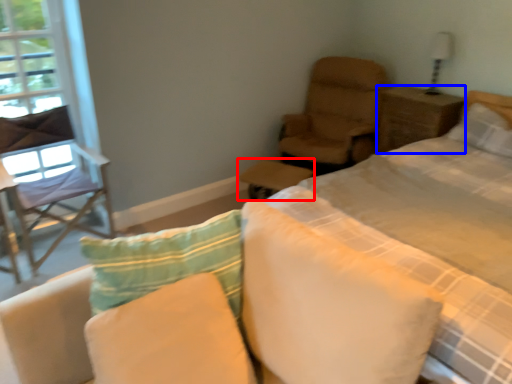
Question: Which of the following is the closest to the observer, table (highlighted by a red box) or nightstand (highlighted by a blue box)?

Choices:
 (A) table
 (B) nightstand

Answer: (A)